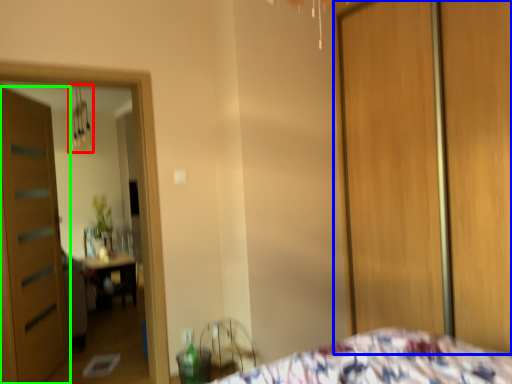
Question: Which object is positioned closest to light fixture (highlighted by a red box)? Select from screen door (highlighted by a blue box) and door (highlighted by a green box).

Choices:
 (A) screen door
 (B) door

Answer: (B)